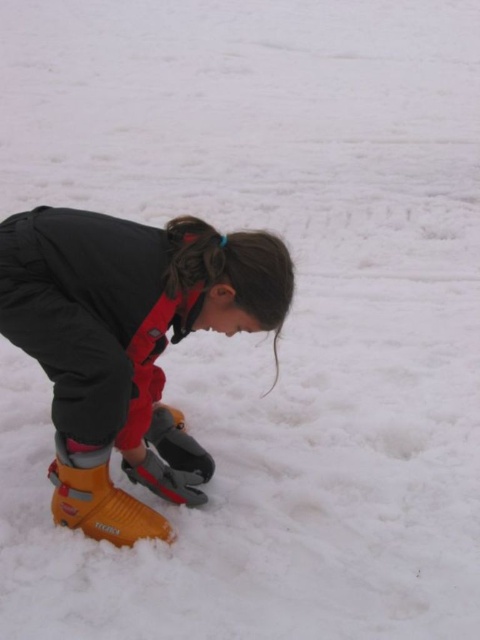
Question: Which point is closer to the camera taking this photo?

Choices:
 (A) (90, 531)
 (B) (120, 378)

Answer: (B)

Question: Can you confirm if orange plastic ski boot at lower left is positioned to the left of yellow plastic ski boot at lower left?

Choices:
 (A) no
 (B) yes

Answer: (A)

Question: Can you confirm if orange plastic ski boot at lower left is positioned to the left of yellow plastic ski boot at lower left?

Choices:
 (A) yes
 (B) no

Answer: (B)

Question: Does orange plastic ski boot at lower left have a greater width compared to yellow plastic ski boot at lower left?

Choices:
 (A) no
 (B) yes

Answer: (B)